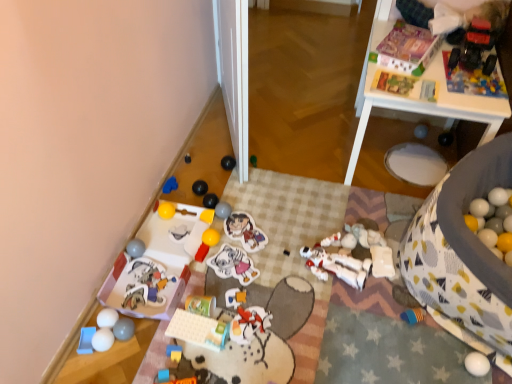
Locate an element on the screen. vacant space to the right of rubber ball at center, the tenth toy when ordered from right to left is located at coordinates (260, 220).